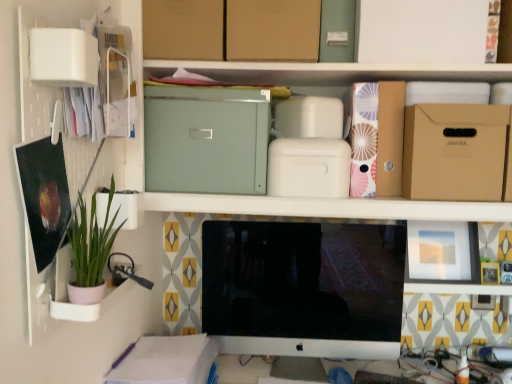
Question: Can you confirm if brown cardboard box at upper right, which appears as the second cardboard box when viewed from the right, is smaller than matte green metal file cabinet at upper center?

Choices:
 (A) no
 (B) yes

Answer: (A)

Question: Is the position of brown cardboard box at upper right, which appears as the second cardboard box when viewed from the right, more distant than that of matte green metal file cabinet at upper center?

Choices:
 (A) no
 (B) yes

Answer: (A)

Question: Can you confirm if brown cardboard box at upper right, acting as the fourth cardboard box starting from the left, is taller than matte green metal file cabinet at upper center?

Choices:
 (A) yes
 (B) no

Answer: (B)

Question: Can you confirm if brown cardboard box at upper right, which appears as the second cardboard box when viewed from the right, is positioned to the left of matte green metal file cabinet at upper center?

Choices:
 (A) no
 (B) yes

Answer: (A)

Question: From the image's perspective, would you say brown cardboard box at upper right, acting as the fourth cardboard box starting from the left, is positioned over matte green metal file cabinet at upper center?

Choices:
 (A) yes
 (B) no

Answer: (B)

Question: Considering their positions, is green matte plant at left located in front of or behind matte green metal file cabinet at upper center, the second cardboard box from the left?

Choices:
 (A) behind
 (B) front

Answer: (B)

Question: Considering the positions of green matte plant at left and matte green metal file cabinet at upper center, the 4th cardboard box positioned from the right, in the image, is green matte plant at left wider or thinner than matte green metal file cabinet at upper center, the 4th cardboard box positioned from the right,?

Choices:
 (A) wide
 (B) thin

Answer: (B)

Question: Is green matte plant at left taller or shorter than matte green metal file cabinet at upper center, the second cardboard box from the left?

Choices:
 (A) short
 (B) tall

Answer: (A)

Question: Considering the positions of green matte plant at left and matte green metal file cabinet at upper center, the 4th cardboard box positioned from the right, in the image, is green matte plant at left bigger or smaller than matte green metal file cabinet at upper center, the 4th cardboard box positioned from the right,?

Choices:
 (A) big
 (B) small

Answer: (B)

Question: From the image's perspective, is brown cardboard box at upper center, acting as the 5th cardboard box starting from the right, above or below green matte plant at left?

Choices:
 (A) below
 (B) above

Answer: (B)

Question: Is brown cardboard box at upper center, acting as the 5th cardboard box starting from the right, wider or thinner than green matte plant at left?

Choices:
 (A) thin
 (B) wide

Answer: (B)

Question: Is brown cardboard box at upper center, which is the 1th cardboard box from left to right, to the left or to the right of green matte plant at left in the image?

Choices:
 (A) left
 (B) right

Answer: (B)

Question: Is brown cardboard box at upper center, acting as the 5th cardboard box starting from the right, spatially inside green matte plant at left, or outside of it?

Choices:
 (A) inside
 (B) outside

Answer: (B)

Question: From their relative heights in the image, would you say brown cardboard box at upper center, which is the 1th cardboard box from left to right, is taller or shorter than brown cardboard box at upper center, acting as the 3th cardboard box starting from the right?

Choices:
 (A) tall
 (B) short

Answer: (A)

Question: Considering their positions, is brown cardboard box at upper center, acting as the 5th cardboard box starting from the right, located in front of or behind brown cardboard box at upper center, which is the third cardboard box from left to right?

Choices:
 (A) behind
 (B) front

Answer: (A)